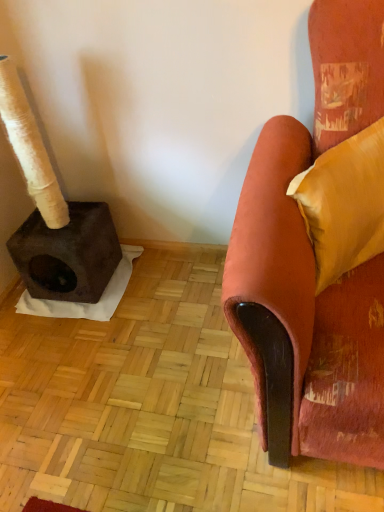
Where is `vacant space that is to the left of velvet orange armchair at right`? vacant space that is to the left of velvet orange armchair at right is located at coordinates (149, 381).